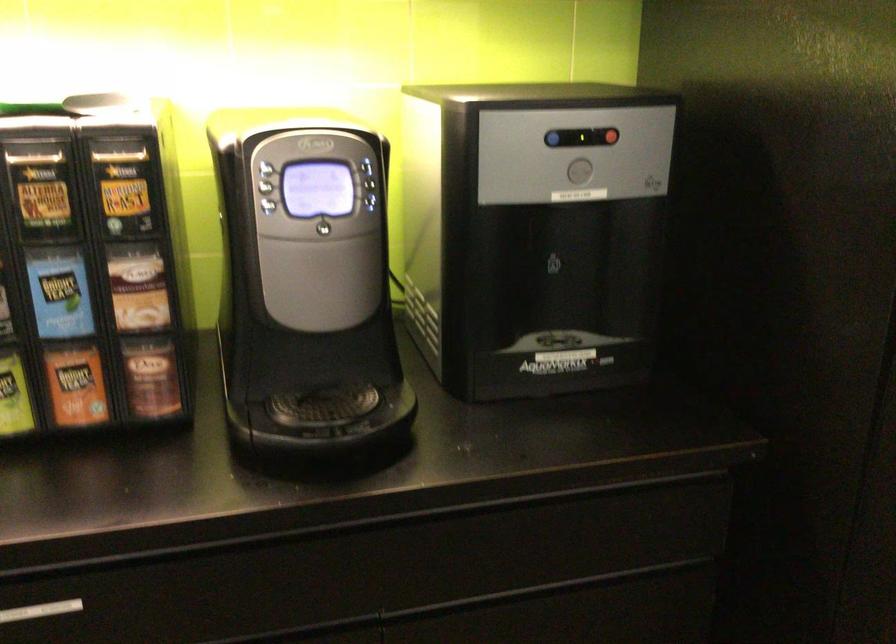
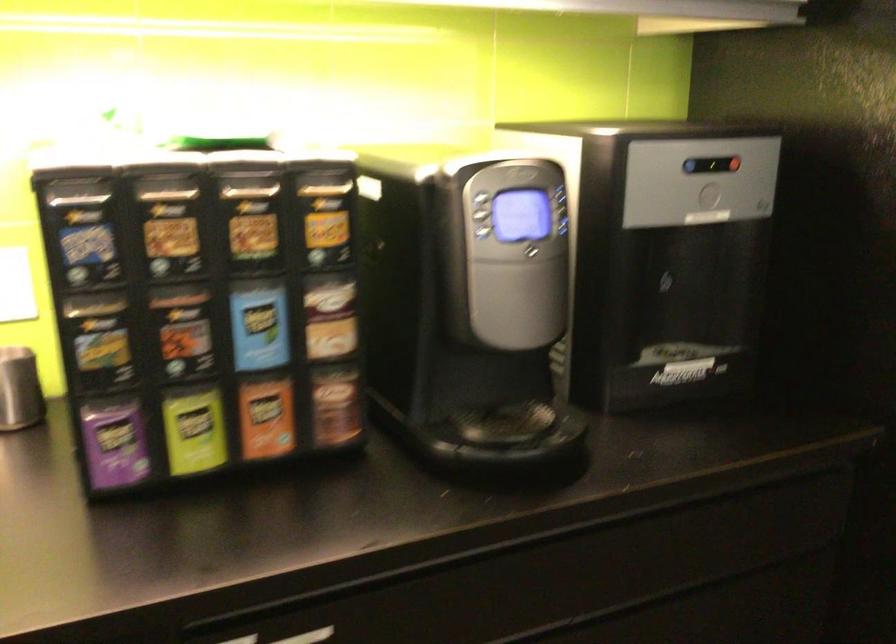
Question: Which direction would the cameraman need to move to produce the second image? Reply with the corresponding letter.

Choices:
 (A) Left
 (B) Right
 (C) Forward
 (D) Backward

Answer: (A)